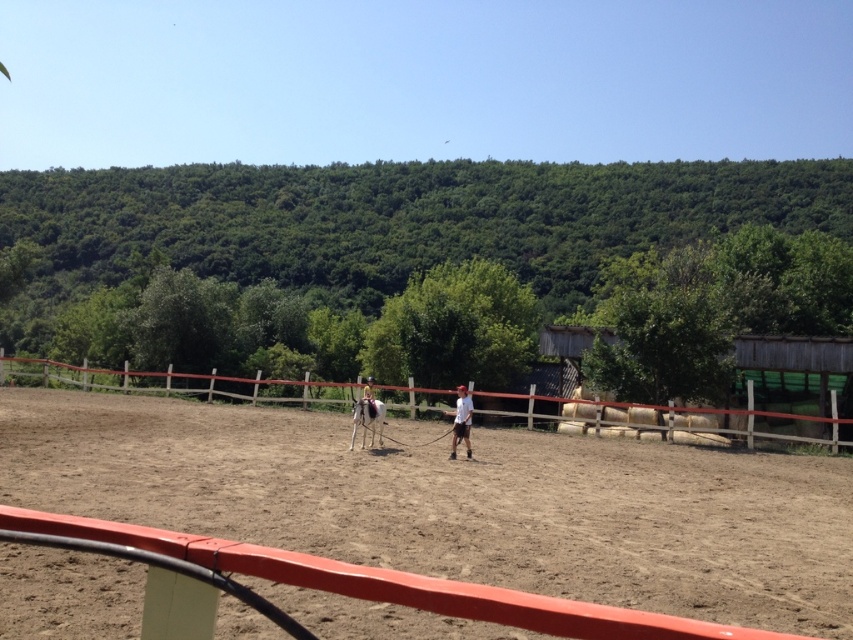
Question: Which object is the closest to the brown sandy dirt at center?

Choices:
 (A) light brown leather jacket at center
 (B) brown wooden fence at center

Answer: (A)

Question: Which point is farther to the camera?

Choices:
 (A) brown sandy dirt at center
 (B) white glossy horse at center

Answer: (B)

Question: Is brown wooden fence at center positioned before white glossy horse at center?

Choices:
 (A) yes
 (B) no

Answer: (B)

Question: Can you confirm if brown sandy dirt at center is positioned below light brown leather jacket at center?

Choices:
 (A) yes
 (B) no

Answer: (A)

Question: Does white glossy horse at center have a larger size compared to light brown leather jacket at center?

Choices:
 (A) no
 (B) yes

Answer: (A)

Question: Which object is farther from the camera taking this photo?

Choices:
 (A) brown sandy dirt at center
 (B) light brown leather jacket at center
 (C) white glossy horse at center
 (D) brown wooden fence at center

Answer: (D)